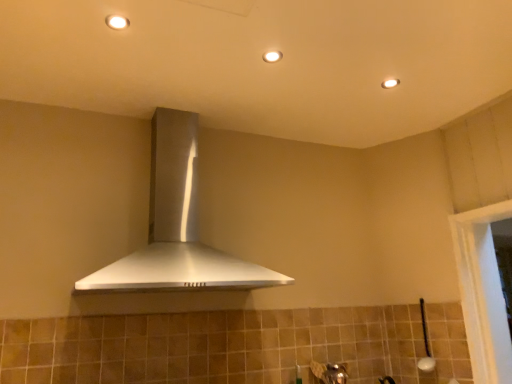
What do you see at coordinates (390, 83) in the screenshot? I see `matte white light fixture at upper center, positioned as the 3th light fixture in front-to-back order` at bounding box center [390, 83].

What do you see at coordinates (177, 226) in the screenshot? This screenshot has height=384, width=512. I see `satin silver range hood at center` at bounding box center [177, 226].

The image size is (512, 384). Identify the location of satin silver range hood at center. (177, 226).

Locate an element on the screen. white glossy light fixture at upper center, which ranks as the first light fixture in front-to-back order is located at coordinates (117, 22).

What is the approximate width of white glossy light fixture at upper center, which is counted as the third light fixture, starting from the bottom?

The width of white glossy light fixture at upper center, which is counted as the third light fixture, starting from the bottom, is 3.64 inches.

Locate an element on the screen. matte white light fixture at upper center, the second light fixture when ordered from left to right is located at coordinates (272, 56).

Is the position of white glossy light fixture at upper center, marked as the 3th light fixture in a back-to-front arrangement, more distant than that of matte white light fixture at upper center, positioned as the second light fixture in top-to-bottom order?

No, white glossy light fixture at upper center, marked as the 3th light fixture in a back-to-front arrangement, is closer to the viewer.

Is point (119, 15) farther from camera compared to point (271, 53)?

No, it is not.

Would you consider white glossy light fixture at upper center, acting as the first light fixture starting from the top, to be distant from matte white light fixture at upper center, which is the second light fixture in back-to-front order?

No.

From the image's perspective, does white glossy light fixture at upper center, marked as the 3th light fixture in a back-to-front arrangement, appear higher than matte white light fixture at upper center, which appears as the 2th light fixture when viewed from the right?

Yes, from the image's perspective, white glossy light fixture at upper center, marked as the 3th light fixture in a back-to-front arrangement, is over matte white light fixture at upper center, which appears as the 2th light fixture when viewed from the right.

Image resolution: width=512 pixels, height=384 pixels. What are the coordinates of `light fixture in front of the matte white light fixture at upper center, which appears as the 2th light fixture when viewed from the right` in the screenshot? It's located at (117, 22).

From their relative heights in the image, would you say matte white light fixture at upper center, the second light fixture when ordered from left to right, is taller or shorter than white glossy light fixture at upper center, acting as the first light fixture starting from the top?

In the image, matte white light fixture at upper center, the second light fixture when ordered from left to right, appears to be shorter than white glossy light fixture at upper center, acting as the first light fixture starting from the top.

How many degrees apart are the facing directions of matte white light fixture at upper center, which is the second light fixture from bottom to top, and white glossy light fixture at upper center, acting as the first light fixture starting from the top?

0.00019 degrees separate the facing orientations of matte white light fixture at upper center, which is the second light fixture from bottom to top, and white glossy light fixture at upper center, acting as the first light fixture starting from the top.

Is matte white light fixture at upper center, the 1th light fixture positioned from the back, beside white glossy light fixture at upper center, the first light fixture when ordered from left to right?

No.

Considering the relative positions of matte white light fixture at upper center, positioned as the third light fixture in left-to-right order, and white glossy light fixture at upper center, the first light fixture when ordered from left to right, in the image provided, is matte white light fixture at upper center, positioned as the third light fixture in left-to-right order, to the right of white glossy light fixture at upper center, the first light fixture when ordered from left to right, from the viewer's perspective?

Yes.

Which is farther, (385,88) or (124,20)?

The point (385,88) is more distant.

Is matte white light fixture at upper center, positioned as the third light fixture in left-to-right order, positioned with its back to white glossy light fixture at upper center, acting as the first light fixture starting from the top?

matte white light fixture at upper center, positioned as the third light fixture in left-to-right order, is not turned away from white glossy light fixture at upper center, acting as the first light fixture starting from the top.

Which object is more forward, matte white light fixture at upper center, which is counted as the first light fixture, starting from the bottom, or matte white light fixture at upper center, which appears as the 2th light fixture when viewed from the right?

matte white light fixture at upper center, which appears as the 2th light fixture when viewed from the right, is in front.

Are matte white light fixture at upper center, positioned as the first light fixture in right-to-left order, and matte white light fixture at upper center, positioned as the second light fixture in top-to-bottom order, located far from each other?

matte white light fixture at upper center, positioned as the first light fixture in right-to-left order, is actually quite close to matte white light fixture at upper center, positioned as the second light fixture in top-to-bottom order.

Can you confirm if matte white light fixture at upper center, the 1th light fixture positioned from the back, is smaller than matte white light fixture at upper center, the second light fixture when ordered from left to right?

Indeed, matte white light fixture at upper center, the 1th light fixture positioned from the back, has a smaller size compared to matte white light fixture at upper center, the second light fixture when ordered from left to right.

From the matte white light fixture at upper center, positioned as the first light fixture in right-to-left order, count the 1st light fixture to the left and point to it. Please provide its 2D coordinates.

[(272, 56)]

From the image's perspective, which light fixture is the 3rd one above the satin silver range hood at center? Please provide its 2D coordinates.

[(117, 22)]

From the image's perspective, between satin silver range hood at center and white glossy light fixture at upper center, the first light fixture when ordered from left to right, who is located below?

From the image's view, satin silver range hood at center is below.

Does satin silver range hood at center come behind white glossy light fixture at upper center, which is counted as the 3th light fixture, starting from the right?

No, the depth of satin silver range hood at center is less than that of white glossy light fixture at upper center, which is counted as the 3th light fixture, starting from the right.

Is satin silver range hood at center with white glossy light fixture at upper center, which is counted as the third light fixture, starting from the bottom?

satin silver range hood at center and white glossy light fixture at upper center, which is counted as the third light fixture, starting from the bottom, are clearly separated.

Between white glossy light fixture at upper center, the first light fixture when ordered from left to right, and matte white light fixture at upper center, which is counted as the third light fixture, starting from the top, which one has larger size?

Bigger between the two is white glossy light fixture at upper center, the first light fixture when ordered from left to right.

Is white glossy light fixture at upper center, the first light fixture when ordered from left to right, oriented away from matte white light fixture at upper center, positioned as the 3th light fixture in front-to-back order?

No.

Which is less distant, (128, 22) or (387, 84)?

Positioned in front is point (128, 22).

Is matte white light fixture at upper center, which is the second light fixture from bottom to top, smaller than satin silver range hood at center?

Correct, matte white light fixture at upper center, which is the second light fixture from bottom to top, occupies less space than satin silver range hood at center.

In the image, is matte white light fixture at upper center, the second light fixture viewed from the front, positioned in front of or behind satin silver range hood at center?

Visually, matte white light fixture at upper center, the second light fixture viewed from the front, is located behind satin silver range hood at center.

Is matte white light fixture at upper center, the second light fixture when ordered from left to right, with satin silver range hood at center?

No, matte white light fixture at upper center, the second light fixture when ordered from left to right, is not next to satin silver range hood at center.

At what (x,y) coordinates should I click in order to perform the action: click on light fixture above the white glossy light fixture at upper center, the first light fixture when ordered from left to right (from a real-world perspective). Please return your answer as a coordinate pair (x, y). This screenshot has height=384, width=512. Looking at the image, I should click on (272, 56).

Where is `the 1st light fixture behind the white glossy light fixture at upper center, which ranks as the first light fixture in front-to-back order`? the 1st light fixture behind the white glossy light fixture at upper center, which ranks as the first light fixture in front-to-back order is located at coordinates (272, 56).

Looking at the image, which one is located further to matte white light fixture at upper center, the 1th light fixture positioned from the back, white glossy light fixture at upper center, which ranks as the first light fixture in front-to-back order, or matte white light fixture at upper center, which is the second light fixture from bottom to top?

The object further to matte white light fixture at upper center, the 1th light fixture positioned from the back, is white glossy light fixture at upper center, which ranks as the first light fixture in front-to-back order.

Based on their spatial positions, is satin silver range hood at center or matte white light fixture at upper center, the 1th light fixture positioned from the back, further from matte white light fixture at upper center, which is the second light fixture from bottom to top?

Based on the image, satin silver range hood at center appears to be further to matte white light fixture at upper center, which is the second light fixture from bottom to top.

When comparing their distances from satin silver range hood at center, does white glossy light fixture at upper center, acting as the first light fixture starting from the top, or matte white light fixture at upper center, positioned as the second light fixture in top-to-bottom order, seem closer?

matte white light fixture at upper center, positioned as the second light fixture in top-to-bottom order, is positioned closer to the anchor satin silver range hood at center.

From the image, which object appears to be nearer to matte white light fixture at upper center, which is the second light fixture in back-to-front order, white glossy light fixture at upper center, which is counted as the third light fixture, starting from the bottom, or satin silver range hood at center?

white glossy light fixture at upper center, which is counted as the third light fixture, starting from the bottom, lies closer to matte white light fixture at upper center, which is the second light fixture in back-to-front order, than the other object.

From the image, which object appears to be farther from matte white light fixture at upper center, positioned as the second light fixture in top-to-bottom order, matte white light fixture at upper center, the 1th light fixture positioned from the back, or white glossy light fixture at upper center, acting as the first light fixture starting from the top?

Among the two, matte white light fixture at upper center, the 1th light fixture positioned from the back, is located further to matte white light fixture at upper center, positioned as the second light fixture in top-to-bottom order.

Based on their spatial positions, is matte white light fixture at upper center, which appears as the 2th light fixture when viewed from the right, or white glossy light fixture at upper center, which is counted as the third light fixture, starting from the bottom, further from matte white light fixture at upper center, which is counted as the third light fixture, starting from the top?

Among the two, white glossy light fixture at upper center, which is counted as the third light fixture, starting from the bottom, is located further to matte white light fixture at upper center, which is counted as the third light fixture, starting from the top.

When comparing their distances from white glossy light fixture at upper center, the first light fixture when ordered from left to right, does matte white light fixture at upper center, positioned as the 3th light fixture in front-to-back order, or satin silver range hood at center seem closer?

satin silver range hood at center is positioned closer to the anchor white glossy light fixture at upper center, the first light fixture when ordered from left to right.

Looking at the image, which one is located closer to white glossy light fixture at upper center, marked as the 3th light fixture in a back-to-front arrangement, matte white light fixture at upper center, which appears as the 2th light fixture when viewed from the right, or satin silver range hood at center?

The object closer to white glossy light fixture at upper center, marked as the 3th light fixture in a back-to-front arrangement, is matte white light fixture at upper center, which appears as the 2th light fixture when viewed from the right.

Where is `home appliance between white glossy light fixture at upper center, acting as the first light fixture starting from the top, and matte white light fixture at upper center, which is counted as the first light fixture, starting from the bottom`? This screenshot has height=384, width=512. home appliance between white glossy light fixture at upper center, acting as the first light fixture starting from the top, and matte white light fixture at upper center, which is counted as the first light fixture, starting from the bottom is located at coordinates (177, 226).

The width and height of the screenshot is (512, 384). What are the coordinates of `light fixture located between white glossy light fixture at upper center, the first light fixture when ordered from left to right, and matte white light fixture at upper center, positioned as the 3th light fixture in front-to-back order, in the left-right direction` in the screenshot? It's located at (272, 56).

Identify the location of light fixture between satin silver range hood at center and matte white light fixture at upper center, positioned as the 3th light fixture in front-to-back order, from left to right. Image resolution: width=512 pixels, height=384 pixels. (272, 56).